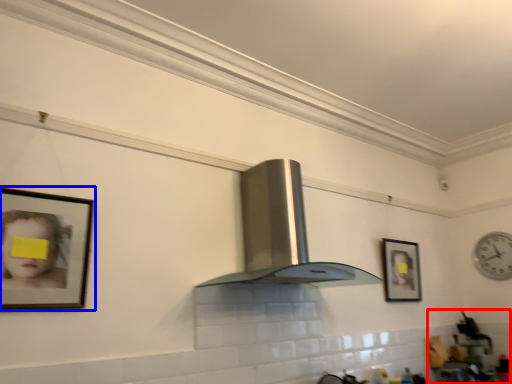
Question: Among these objects, which one is nearest to the camera, sink (highlighted by a red box) or picture frame (highlighted by a blue box)?

Choices:
 (A) sink
 (B) picture frame

Answer: (B)